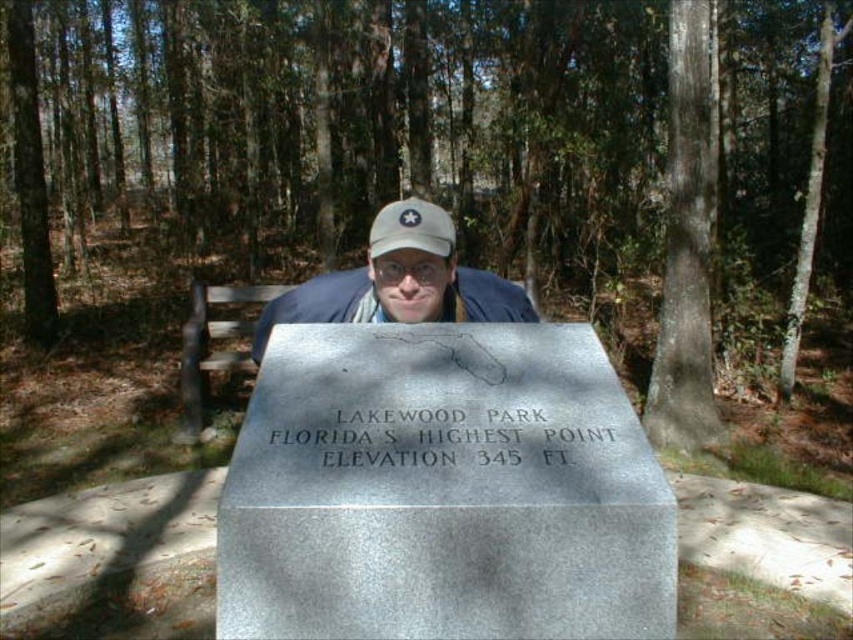
You are a hiker who wants to take a photo of the stone marker at Lakewood Park. You notice two points marked on your map as coordinates. The first point is at position (438, 240) and the second at (402, 212). According to the map, which point should you stand at to ensure the stone marker is fully visible without any obstruction from the person?

You should stand at point (402, 212) because point (438, 240) is in front of point (402, 212), meaning the person would block the view from the first point but not from the second.

You are a park visitor who wants to take a photo of the brown wooden bench at left without the white matte cap at center blocking it. Based on their positions, which direction should you move to ensure the bench is fully visible?

The white matte cap at center is above the brown wooden bench at left, so to take a photo of the brown wooden bench at left without obstruction, move to the left side so the cap is no longer in front of the bench.